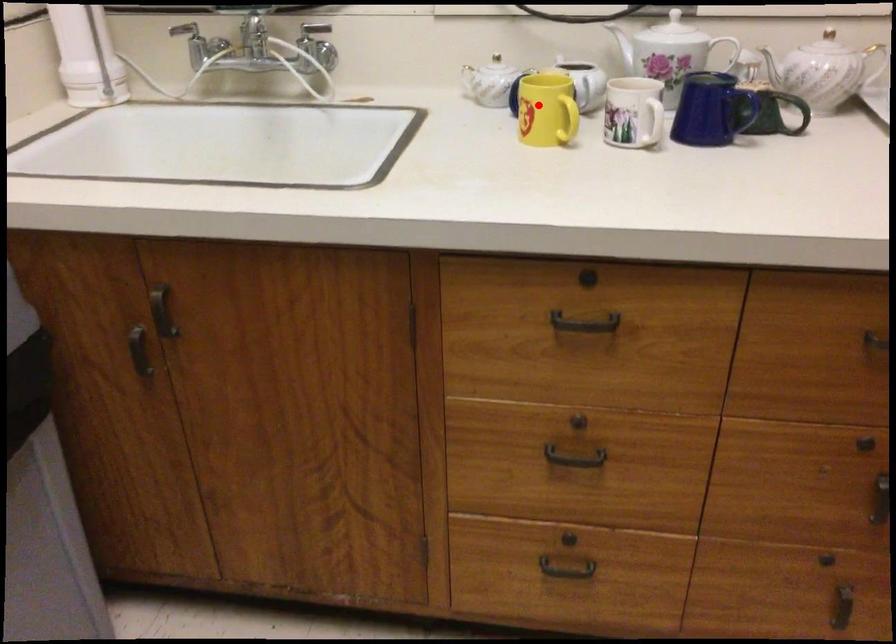
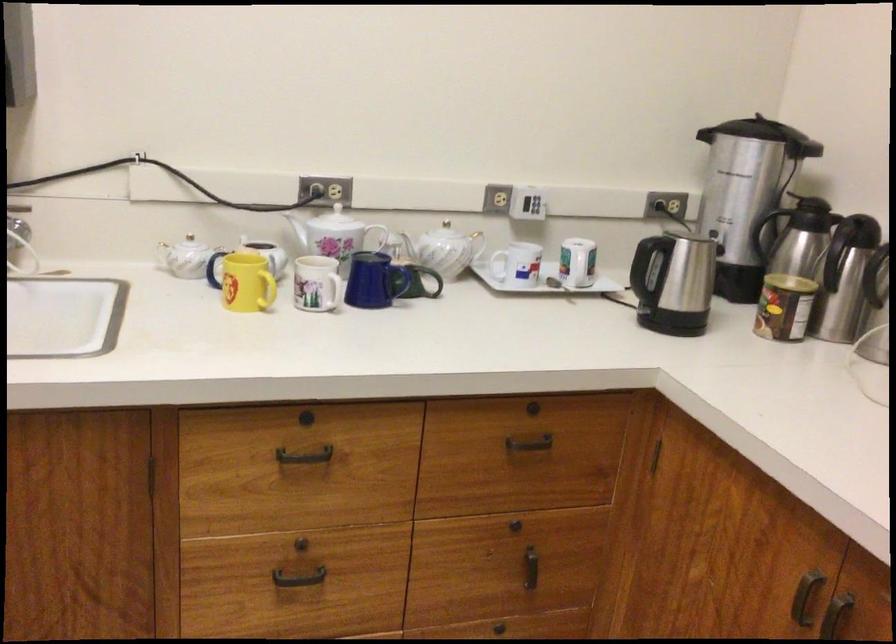
Find the pixel in the second image that matches the highlighted location in the first image.

(245, 281)